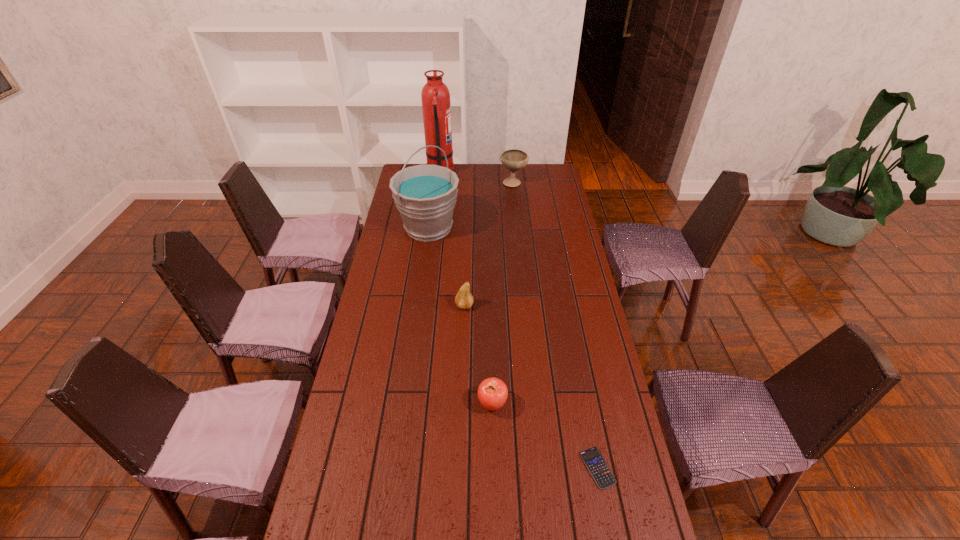
The image size is (960, 540). I want to click on free space between the rightmost object and the fourth object from left to right, so click(x=545, y=436).

This screenshot has height=540, width=960. In order to click on empty location between the nearest object and the second tallest object in this screenshot , I will do `click(513, 348)`.

This screenshot has height=540, width=960. Identify the location of vacant space that is in between the fifth object from left to right and the pear. (489, 244).

Identify the location of free area in between the tallest object and the chalice. (477, 178).

Locate which object is the fourth closest to the fire extinguisher. Please provide its 2D coordinates. Your answer should be formatted as a tuple, i.e. [(x, y)], where the tuple contains the x and y coordinates of a point satisfying the conditions above.

[(492, 392)]

Identify which object is located as the second nearest to the fourth farthest object. Please provide its 2D coordinates. Your answer should be formatted as a tuple, i.e. [(x, y)], where the tuple contains the x and y coordinates of a point satisfying the conditions above.

[(492, 392)]

You are a GUI agent. You are given a task and a screenshot of the screen. Output one action in this format:
    pyautogui.click(x=<x>, y=<y>)
    Task: Click on the vacant space that satisfies the following two spatial constraints: 1. on the back side of the chalice; 2. on the label side of the tallest object
    This screenshot has height=540, width=960.
    Given the screenshot: What is the action you would take?
    pyautogui.click(x=513, y=174)

In order to click on free space that satisfies the following two spatial constraints: 1. on the label side of the tallest object; 2. on the right side of the apple in this screenshot , I will do `click(411, 403)`.

Where is `free spot that satisfies the following two spatial constraints: 1. on the label side of the third tallest object; 2. on the right side of the tallest object`? This screenshot has height=540, width=960. free spot that satisfies the following two spatial constraints: 1. on the label side of the third tallest object; 2. on the right side of the tallest object is located at coordinates (440, 182).